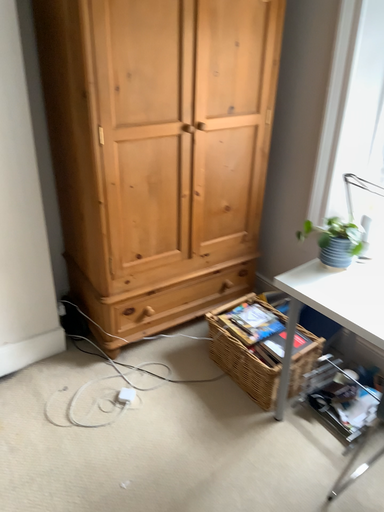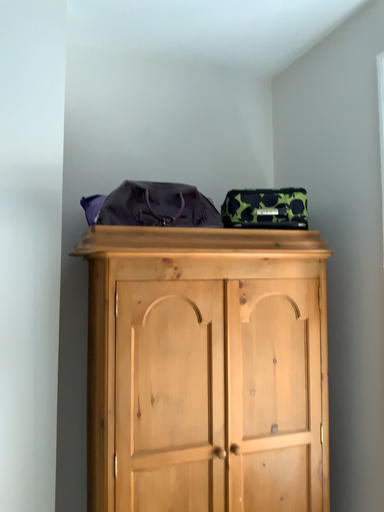
Question: How did the camera likely rotate when shooting the video?

Choices:
 (A) rotated right
 (B) rotated left

Answer: (B)